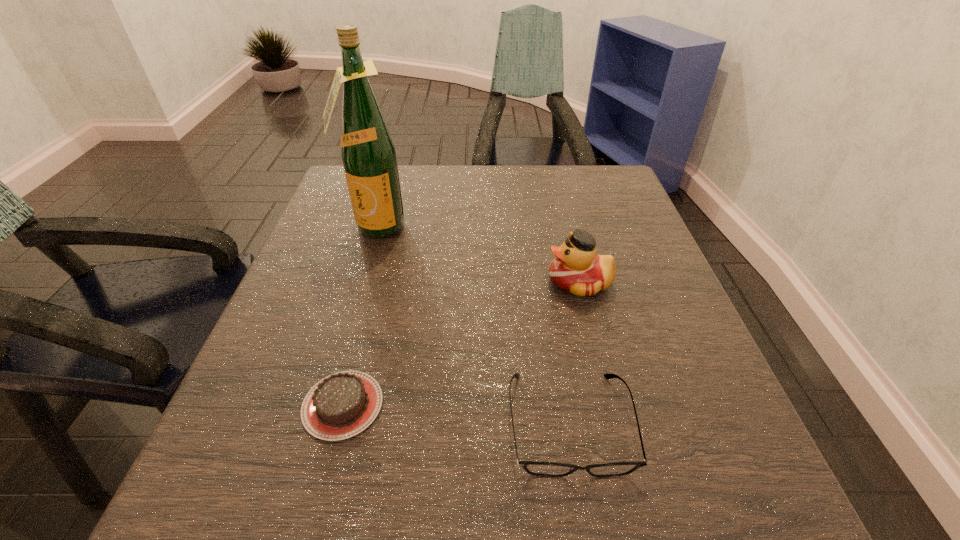
This screenshot has width=960, height=540. Find the location of `vacant region located 0.060m on the front-facing side of the spectacles`. vacant region located 0.060m on the front-facing side of the spectacles is located at coordinates (588, 532).

Locate an element on the screen. This screenshot has height=540, width=960. free space located on the right of the shortest object is located at coordinates (416, 405).

You are a GUI agent. You are given a task and a screenshot of the screen. Output one action in this format:
    pyautogui.click(x=<x>, y=<y>)
    Task: Click on the object situated at the far edge
    
    Given the screenshot: What is the action you would take?
    pyautogui.click(x=368, y=154)

You are a GUI agent. You are given a task and a screenshot of the screen. Output one action in this format:
    pyautogui.click(x=<x>, y=<y>)
    Task: Click on the object that is at the near edge
    This screenshot has width=960, height=540.
    Given the screenshot: What is the action you would take?
    pyautogui.click(x=547, y=469)

Identify the location of liquor located in the left edge section of the desktop. (368, 154).

The image size is (960, 540). What are the coordinates of `chocolate cake that is at the left edge` in the screenshot? It's located at (341, 405).

Find the location of `duck present at the right edge`. duck present at the right edge is located at coordinates (577, 269).

Find the location of a particular element. This screenshot has width=960, height=540. spectacles that is at the right edge is located at coordinates (547, 469).

You are a GUI agent. You are given a task and a screenshot of the screen. Output one action in this format:
    pyautogui.click(x=<x>, y=<y>)
    Task: Click on the object situated at the far left corner
    
    Given the screenshot: What is the action you would take?
    pyautogui.click(x=368, y=154)

At what (x,y) coordinates should I click in order to perform the action: click on object that is at the near right corner. Please return your answer as a coordinate pair (x, y). The height and width of the screenshot is (540, 960). Looking at the image, I should click on (547, 469).